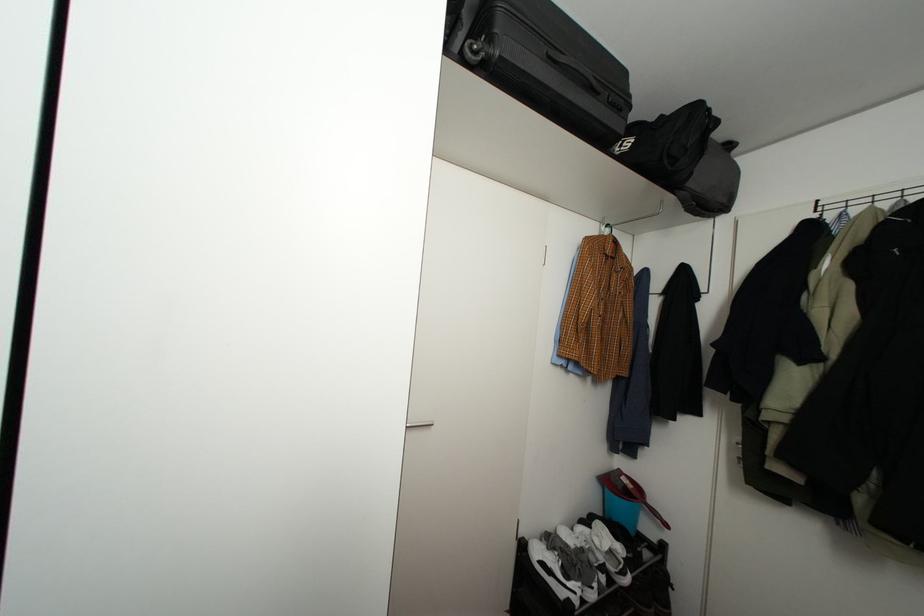
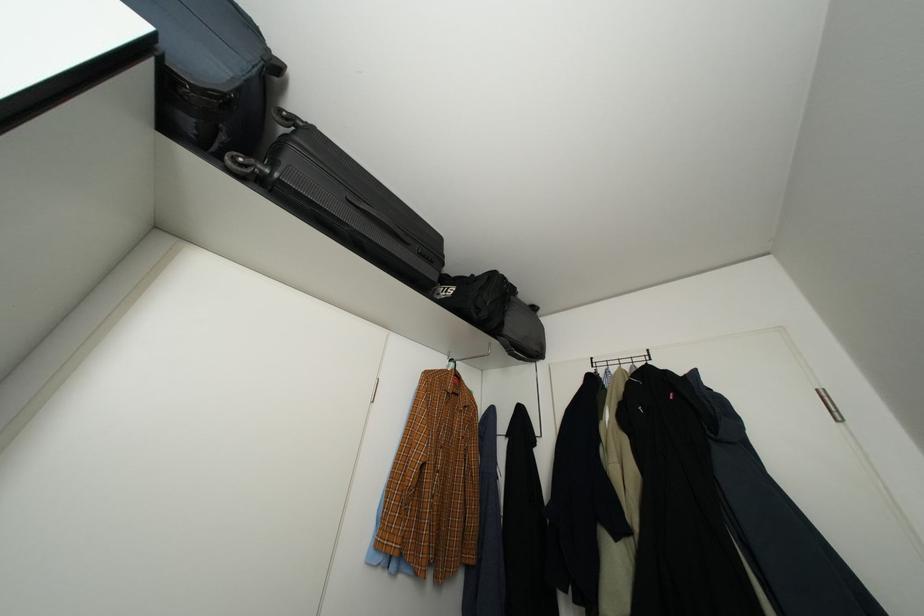
How did the camera likely rotate?

The camera's rotation is toward right-up.